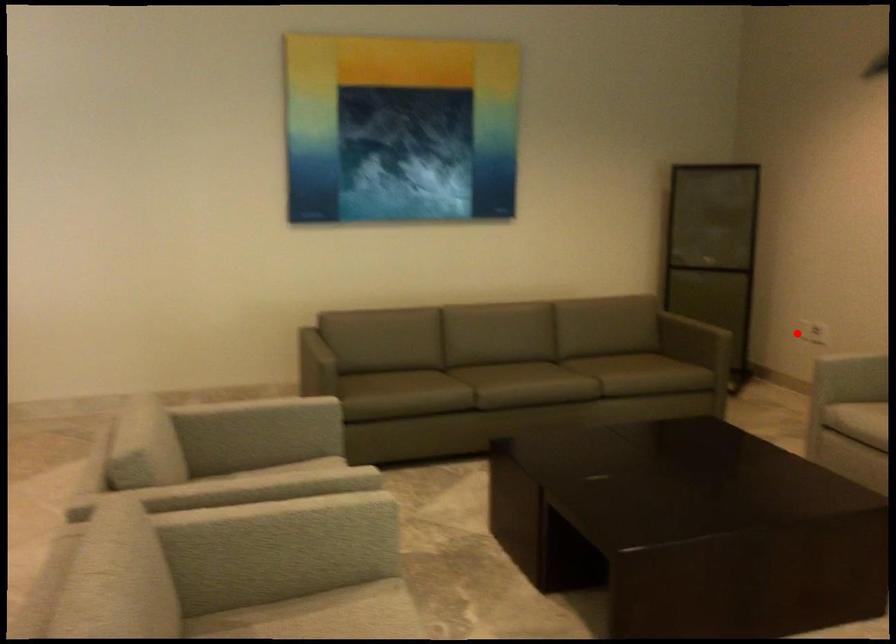
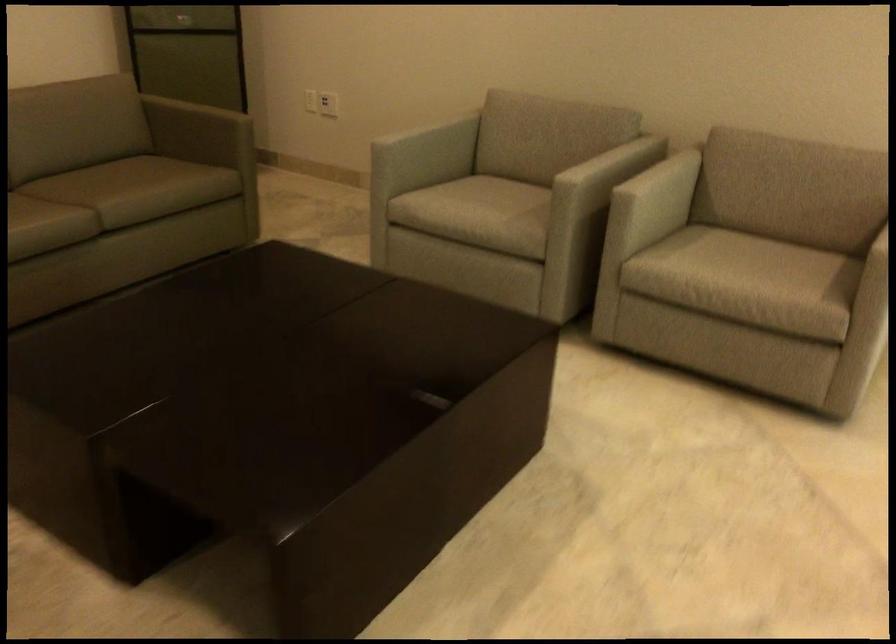
Where in the second image is the point corresponding to the highlighted location from the first image?

(328, 104)